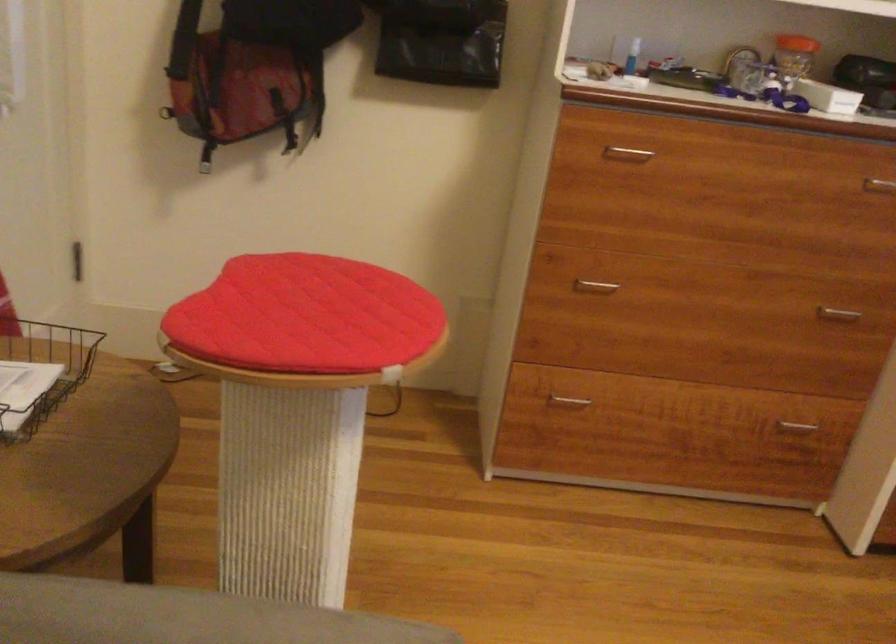
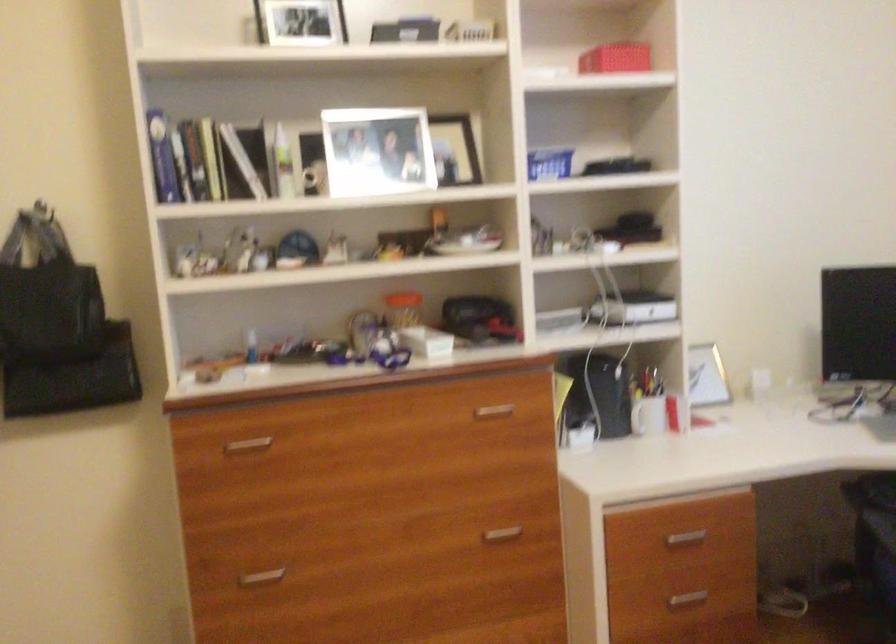
Where in the second image is the point corresponding to pixel 623 149 from the first image?

(247, 444)